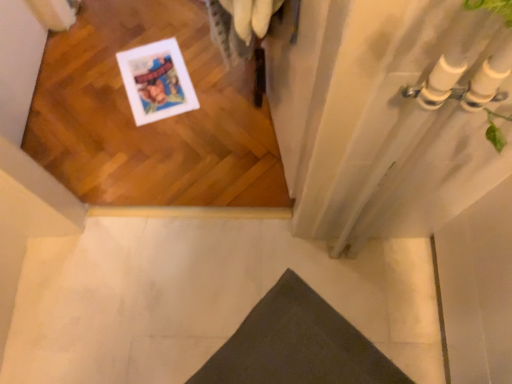
You are a GUI agent. You are given a task and a screenshot of the screen. Output one action in this format:
    pyautogui.click(x=<x>, y=<y>)
    Task: Click on the free space above dark gray fabric doormat at lower center (from a real-world perspective)
    
    Given the screenshot: What is the action you would take?
    pyautogui.click(x=290, y=350)